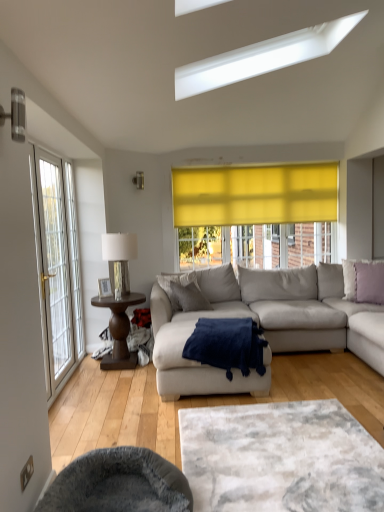
Identify the location of metallic silver lamp at upper center. Image resolution: width=384 pixels, height=512 pixels. (138, 180).

The height and width of the screenshot is (512, 384). What do you see at coordinates (138, 180) in the screenshot?
I see `metallic silver lamp at upper center` at bounding box center [138, 180].

What is the approximate width of metallic silver table lamp at left?

metallic silver table lamp at left is 15.09 inches in width.

Image resolution: width=384 pixels, height=512 pixels. What are the coordinates of `light gray fabric couch at center` in the screenshot? It's located at (265, 324).

Image resolution: width=384 pixels, height=512 pixels. What do you see at coordinates (369, 281) in the screenshot?
I see `lavender fabric pillow at right, the second pillow in the left-to-right sequence` at bounding box center [369, 281].

Locate an element on the screen. white textured rug at center is located at coordinates (280, 458).

Is white textured rug at center far from white glass door at left?

Yes.

Considering the relative positions of white textured rug at center and white glass door at left in the image provided, is white textured rug at center to the left or to the right of white glass door at left?

white textured rug at center is to the right of white glass door at left.

Is white glass door at left inside white textured rug at center?

No.

From the image's perspective, which one is positioned lower, white textured rug at center or white glass door at left?

white textured rug at center appears lower in the image.

Can you confirm if metallic silver table lamp at left is positioned to the left of navy blue plush blanket at center?

Indeed, metallic silver table lamp at left is positioned on the left side of navy blue plush blanket at center.

Is metallic silver table lamp at left positioned in front of navy blue plush blanket at center?

No, metallic silver table lamp at left is further to the viewer.

Looking at their sizes, would you say metallic silver table lamp at left is wider or thinner than navy blue plush blanket at center?

metallic silver table lamp at left is thinner than navy blue plush blanket at center.

Locate an element on the screen. blanket in front of the metallic silver table lamp at left is located at coordinates (227, 345).

Is point (111, 288) closer or farther from the camera than point (280, 319)?

Clearly, point (111, 288) is more distant from the camera than point (280, 319).

Identify the location of table lamp behind the light gray fabric couch at center. The image size is (384, 512). (119, 258).

Is metallic silver table lamp at left facing away from light gray fabric couch at center?

metallic silver table lamp at left does not have its back to light gray fabric couch at center.

From a real-world perspective, who is located lower, metallic silver table lamp at left or light gray fabric couch at center?

In real-world perspective, light gray fabric couch at center is lower.

Does metallic silver lamp at upper center come in front of gray fabric pillow at center, the 1th pillow from the left?

No, it is not.

How distant is metallic silver lamp at upper center from gray fabric pillow at center, which ranks as the second pillow in right-to-left order?

A distance of 1.37 meters exists between metallic silver lamp at upper center and gray fabric pillow at center, which ranks as the second pillow in right-to-left order.

From the image's perspective, is metallic silver lamp at upper center located above gray fabric pillow at center, which ranks as the second pillow in right-to-left order?

Yes, from the image's perspective, metallic silver lamp at upper center is over gray fabric pillow at center, which ranks as the second pillow in right-to-left order.

Are metallic silver lamp at upper center and gray fabric pillow at center, the 1th pillow from the left, making contact?

metallic silver lamp at upper center and gray fabric pillow at center, the 1th pillow from the left, are clearly separated.

From the image's perspective, who appears lower, white glass door at left or metallic silver table lamp at left?

From the image's view, white glass door at left is below.

From a real-world perspective, is white glass door at left below metallic silver table lamp at left?

No, from a real-world perspective, white glass door at left is not beneath metallic silver table lamp at left.

Which of these two, white glass door at left or metallic silver table lamp at left, is smaller?

metallic silver table lamp at left is smaller.

Where is `studio couch below the metallic silver lamp at upper center (from the image's perspective)`? This screenshot has height=512, width=384. studio couch below the metallic silver lamp at upper center (from the image's perspective) is located at coordinates (265, 324).

Who is shorter, metallic silver lamp at upper center or light gray fabric couch at center?

With less height is metallic silver lamp at upper center.

Which of these two, metallic silver lamp at upper center or light gray fabric couch at center, is smaller?

With smaller size is metallic silver lamp at upper center.

From the image's perspective, which is below, metallic silver lamp at upper center or light gray fabric couch at center?

light gray fabric couch at center.

Consider the image. Is metallic silver lamp at upper center not near lavender fabric pillow at right, which is the first pillow from right to left?

Indeed, metallic silver lamp at upper center is not near lavender fabric pillow at right, which is the first pillow from right to left.

From a real-world perspective, is metallic silver lamp at upper center under lavender fabric pillow at right, the second pillow in the left-to-right sequence?

Actually, metallic silver lamp at upper center is physically above lavender fabric pillow at right, the second pillow in the left-to-right sequence, in the real world.

Is metallic silver lamp at upper center turned away from lavender fabric pillow at right, the second pillow in the left-to-right sequence?

That's not correct — metallic silver lamp at upper center is not looking away from lavender fabric pillow at right, the second pillow in the left-to-right sequence.

Which of these two, metallic silver lamp at upper center or lavender fabric pillow at right, which is the first pillow from right to left, is thinner?

Thinner between the two is metallic silver lamp at upper center.

Find the location of a particular element. The height and width of the screenshot is (512, 384). door above the white textured rug at center (from a real-world perspective) is located at coordinates (59, 266).

Identify the location of table lamp behind the navy blue plush blanket at center. (119, 258).

From the image, which object appears to be farther from light gray fabric couch at center, white glass door at left or metallic silver lamp at upper center?

metallic silver lamp at upper center is positioned further to the anchor light gray fabric couch at center.

Based on their spatial positions, is white textured rug at center or metallic silver lamp at upper center further from dark brown wooden side table at left?

Among the two, white textured rug at center is located further to dark brown wooden side table at left.

Which object lies further to the anchor point white glass door at left, gray fabric pillow at center, which ranks as the second pillow in right-to-left order, or white textured rug at center?

white textured rug at center lies further to white glass door at left than the other object.

From the image, which object appears to be farther from navy blue plush blanket at center, gray fabric pillow at center, which ranks as the second pillow in right-to-left order, or light gray fabric couch at center?

gray fabric pillow at center, which ranks as the second pillow in right-to-left order, is positioned further to the anchor navy blue plush blanket at center.

Based on their spatial positions, is metallic silver lamp at upper center or metallic silver table lamp at left closer to dark brown wooden side table at left?

metallic silver table lamp at left is closer to dark brown wooden side table at left.

Based on their spatial positions, is dark brown wooden side table at left or white glass door at left closer to gray fabric pillow at center, which ranks as the second pillow in right-to-left order?

dark brown wooden side table at left lies closer to gray fabric pillow at center, which ranks as the second pillow in right-to-left order, than the other object.

Which object lies nearer to the anchor point white textured rug at center, gray fabric pillow at center, which ranks as the second pillow in right-to-left order, or light gray fabric couch at center?

light gray fabric couch at center is closer to white textured rug at center.

Based on their spatial positions, is metallic silver lamp at upper center or light gray fabric couch at center further from dark brown wooden side table at left?

Based on the image, metallic silver lamp at upper center appears to be further to dark brown wooden side table at left.

The image size is (384, 512). What are the coordinates of `coffee table between velvet grey swivel chair at lower left and metallic silver table lamp at left from front to back` in the screenshot? It's located at (119, 330).

The height and width of the screenshot is (512, 384). I want to click on coffee table between metallic silver table lamp at left and lavender fabric pillow at right, the second pillow in the left-to-right sequence, so click(x=119, y=330).

Where is `blanket between velvet grey swivel chair at lower left and metallic silver table lamp at left in the front-back direction`? The width and height of the screenshot is (384, 512). blanket between velvet grey swivel chair at lower left and metallic silver table lamp at left in the front-back direction is located at coordinates (227, 345).

What are the coordinates of `coffee table between velvet grey swivel chair at lower left and lavender fabric pillow at right, which is the first pillow from right to left, from front to back` in the screenshot? It's located at click(119, 330).